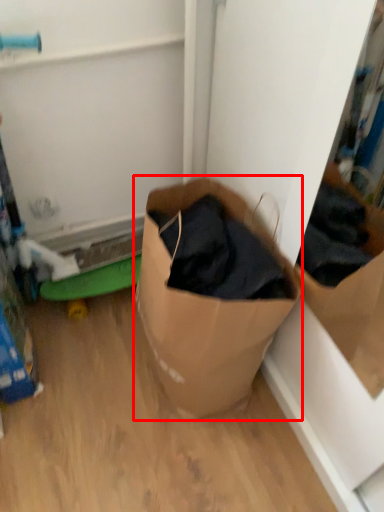
Question: Considering the relative positions of box (annotated by the red box) and toy in the image provided, where is box (annotated by the red box) located with respect to the staircase?

Choices:
 (A) right
 (B) left

Answer: (A)